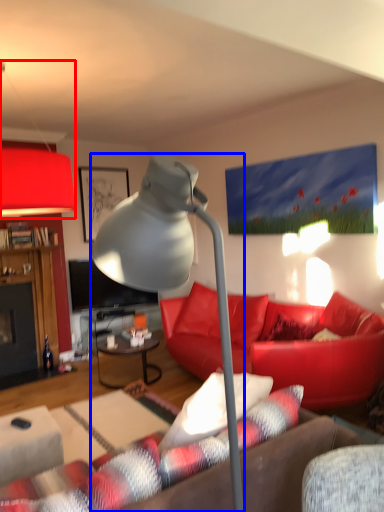
Question: Which point is further to the camera, lamp (highlighted by a red box) or lamp (highlighted by a blue box)?

Choices:
 (A) lamp
 (B) lamp

Answer: (A)